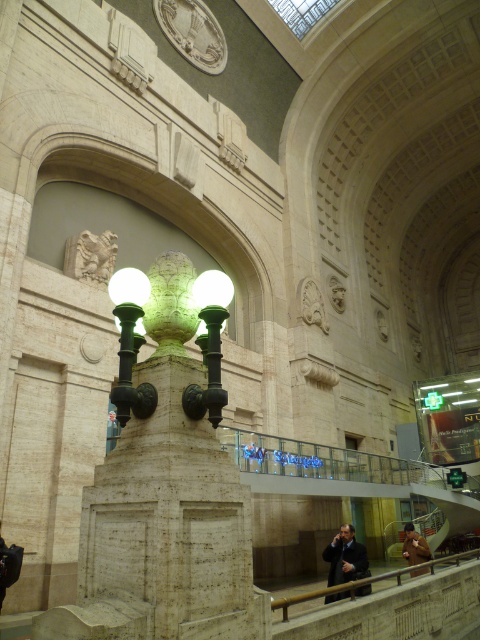
Question: Considering the real-world distances, which object is closest to the green polished stone lamp post at center?

Choices:
 (A) polished wood railing at lower right
 (B) brown leather jacket at lower right
 (C) dark suit at center

Answer: (A)

Question: Is the position of polished wood railing at lower right less distant than that of brown leather jacket at lower right?

Choices:
 (A) no
 (B) yes

Answer: (B)

Question: Among these objects, which one is farthest from the camera?

Choices:
 (A) green polished metal lamp post at center
 (B) dark suit at center
 (C) brown leather jacket at lower right

Answer: (C)

Question: Does green polished stone lamp post at center appear on the left side of polished wood railing at lower right?

Choices:
 (A) yes
 (B) no

Answer: (A)

Question: Which object is the farthest from the green polished metal lamp post at center?

Choices:
 (A) green polished stone lamp post at center
 (B) dark suit at center
 (C) brown leather jacket at lower right

Answer: (C)

Question: Is green polished stone lamp post at center below dark suit at center?

Choices:
 (A) no
 (B) yes

Answer: (A)